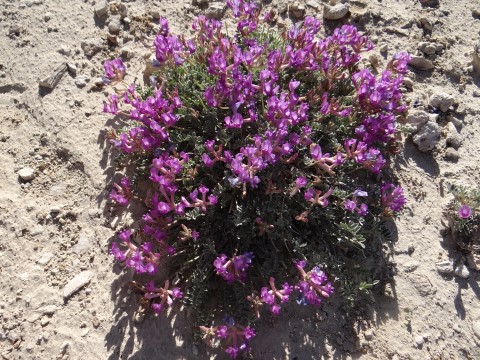
Find the location of a particular element. green plant is located at coordinates (191, 89).